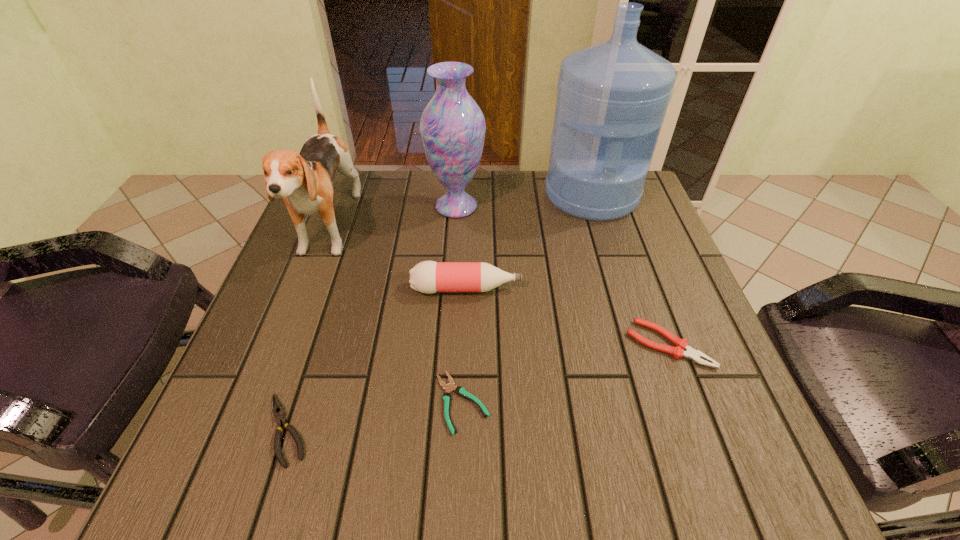
Where is `free region at the far left corner of the desktop`? This screenshot has height=540, width=960. free region at the far left corner of the desktop is located at coordinates (366, 222).

The height and width of the screenshot is (540, 960). What are the coordinates of `free spot at the far right corner of the desktop` in the screenshot? It's located at (658, 221).

Identify the location of vacant space at the near right corner. This screenshot has height=540, width=960. 763,481.

Identify the location of vacant space that is in between the water jug and the second shortest pliers. This screenshot has width=960, height=540. (439, 312).

The height and width of the screenshot is (540, 960). Identify the location of vacant space in between the bottle and the tallest pliers. (567, 316).

Identify the location of free space between the shortest object and the puppy. The height and width of the screenshot is (540, 960). (396, 316).

I want to click on empty space between the vase and the leftmost pliers, so click(x=372, y=318).

Where is `free spot between the tallest object and the shortest pliers`? This screenshot has width=960, height=540. free spot between the tallest object and the shortest pliers is located at coordinates (527, 299).

The width and height of the screenshot is (960, 540). What are the coordinates of `blank region between the shortest pliers and the puppy` in the screenshot? It's located at (396, 316).

Image resolution: width=960 pixels, height=540 pixels. What are the coordinates of `vacant point located between the shortest pliers and the tallest object` in the screenshot? It's located at (527, 299).